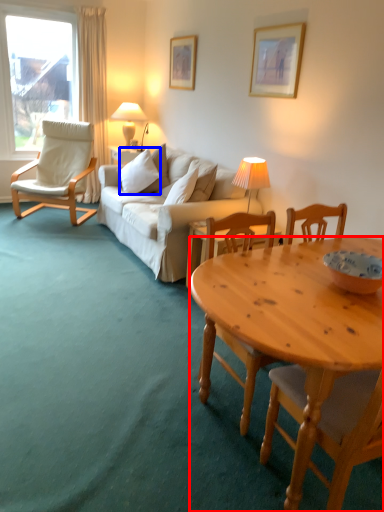
Question: Which of the following is the farthest to the observer, desk (highlighted by a red box) or pillow (highlighted by a blue box)?

Choices:
 (A) desk
 (B) pillow

Answer: (B)